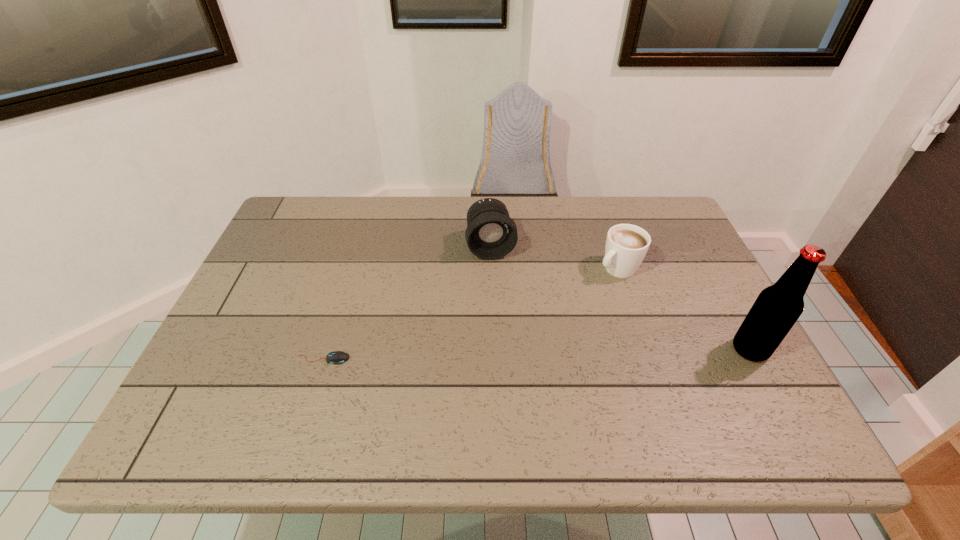
In the image, there is a desktop. Where is `free region at the left edge`? The image size is (960, 540). free region at the left edge is located at coordinates (257, 329).

Where is `free space at the right edge of the desktop`? free space at the right edge of the desktop is located at coordinates (697, 342).

Where is `vacant region at the far left corner of the desktop`? Image resolution: width=960 pixels, height=540 pixels. vacant region at the far left corner of the desktop is located at coordinates (281, 232).

At what (x,y) coordinates should I click in order to perform the action: click on vacant region at the far right corner of the desktop. Please return your answer as a coordinate pair (x, y). Looking at the image, I should click on (633, 223).

The width and height of the screenshot is (960, 540). In order to click on vacant area between the mouse and the rightmost object in this screenshot , I will do `click(537, 354)`.

The width and height of the screenshot is (960, 540). Find the location of `vacant area between the third shortest object and the second shortest object`. vacant area between the third shortest object and the second shortest object is located at coordinates (554, 257).

Where is `empty space between the cappuccino and the second object from left to right`? The height and width of the screenshot is (540, 960). empty space between the cappuccino and the second object from left to right is located at coordinates (554, 257).

Where is `free space between the second object from left to right and the third tallest object`? free space between the second object from left to right and the third tallest object is located at coordinates (554, 257).

I want to click on free space between the second tallest object and the leftmost object, so click(x=407, y=302).

Identify the location of vacant area between the mouse and the tallest object. (537, 354).